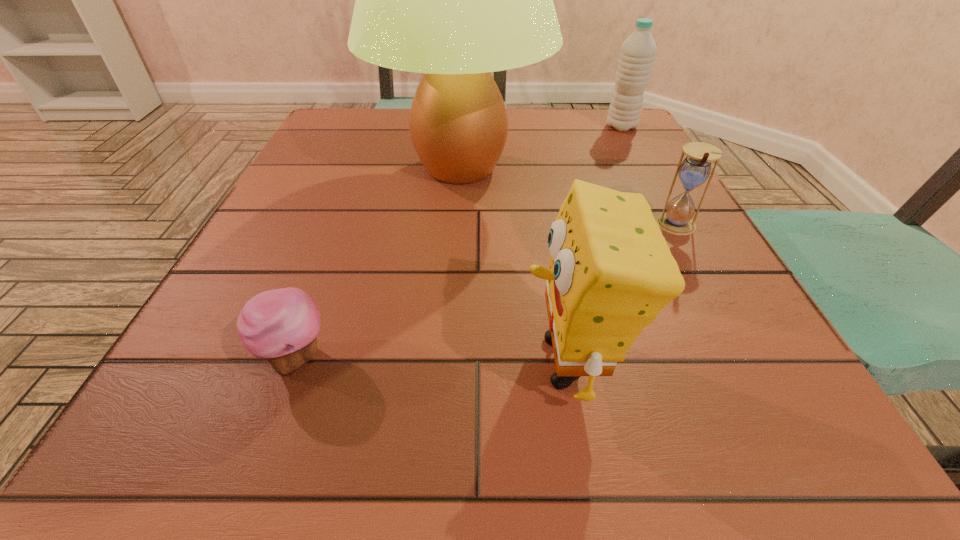
At what (x,y) coordinates should I click in order to perform the action: click on free space located on the left of the hourglass. Please return your answer as a coordinate pair (x, y). The width and height of the screenshot is (960, 540). Looking at the image, I should click on (431, 226).

Where is `free space located on the back of the cupcake`? free space located on the back of the cupcake is located at coordinates (348, 217).

Where is `lampshade located in the far edge section of the desktop`? The width and height of the screenshot is (960, 540). lampshade located in the far edge section of the desktop is located at coordinates [x=455, y=0].

I want to click on water bottle present at the far edge, so click(x=638, y=51).

Image resolution: width=960 pixels, height=540 pixels. Identify the location of object located at the near edge. (611, 272).

Where is `lampshade at the left edge`? The width and height of the screenshot is (960, 540). lampshade at the left edge is located at coordinates (455, 0).

Locate an element on the screen. The width and height of the screenshot is (960, 540). cupcake that is positioned at the left edge is located at coordinates (281, 325).

Locate an element on the screen. Image resolution: width=960 pixels, height=540 pixels. water bottle at the right edge is located at coordinates (638, 51).

Where is `hourglass that is at the right edge`? The image size is (960, 540). hourglass that is at the right edge is located at coordinates (695, 169).

Image resolution: width=960 pixels, height=540 pixels. I want to click on object at the far left corner, so click(455, 0).